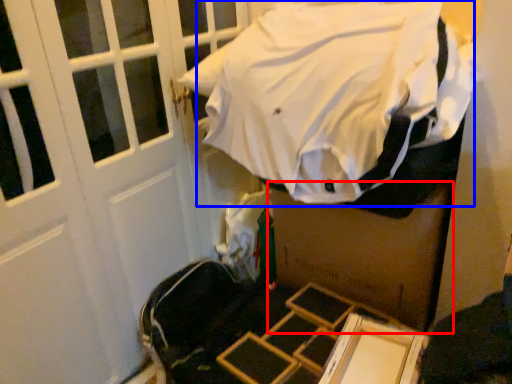
Question: Among these objects, which one is farthest to the camera, box (highlighted by a red box) or sheet (highlighted by a blue box)?

Choices:
 (A) box
 (B) sheet

Answer: (A)